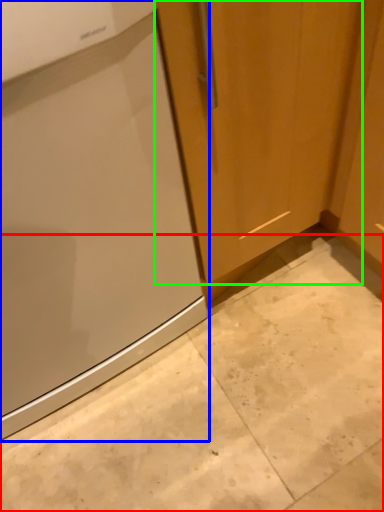
Question: Considering the real-world distances, which object is farthest from concrete (highlighted by a red box)? home appliance (highlighted by a blue box) or door (highlighted by a green box)?

Choices:
 (A) home appliance
 (B) door

Answer: (B)